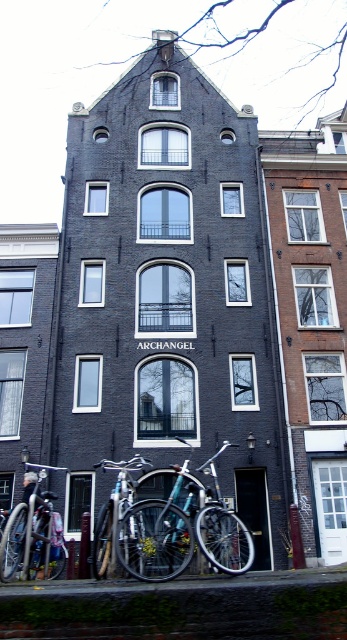
You are standing in front of the Dutch building and want to park your bicycle. You see two shiny metallic bicycles already parked. Which bicycle is positioned higher up, the shiny metallic bicycle at center or the shiny metallic bicycle at lower left?

The shiny metallic bicycle at center is positioned higher up than the shiny metallic bicycle at lower left.

You are standing in front of the traditional Dutch building and notice a shiny metallic bicycle at lower left. According to the coordinates provided, is the bicycle closer to the main building or the neighboring building?

The shiny metallic bicycle at lower left is located at point (32, 536). Since the neighboring building is to the right of the main building, the bicycle is closer to the neighboring building based on its coordinates.